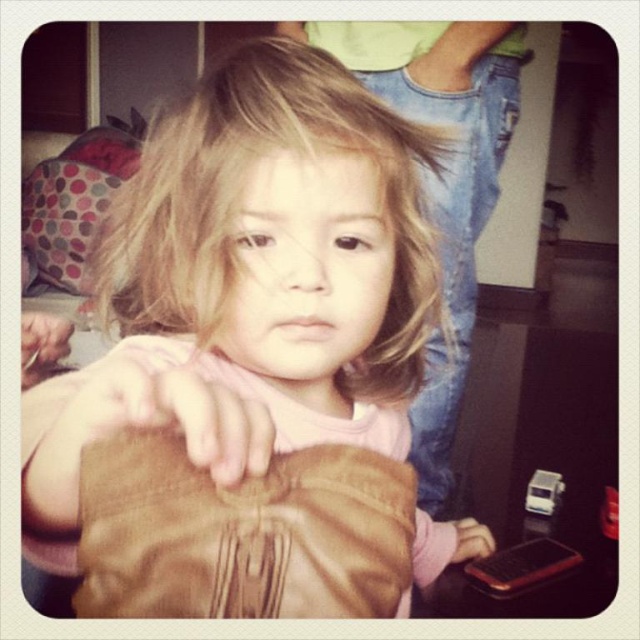
Question: Among these points, which one is farthest from the camera?

Choices:
 (A) (64, 353)
 (B) (163, 413)
 (C) (192, 588)

Answer: (A)

Question: Among these objects, which one is farthest from the camera?

Choices:
 (A) brown leather handbag at lower left
 (B) brown leather handbag at lower right
 (C) leather glove at center

Answer: (B)

Question: Does matte brown purse at center have a lesser width compared to brown leather handbag at lower right?

Choices:
 (A) yes
 (B) no

Answer: (B)

Question: Which of the following is the farthest from the observer?

Choices:
 (A) (477, 550)
 (B) (225, 413)

Answer: (A)

Question: Is matte brown purse at center above matte brown jacket at center?

Choices:
 (A) yes
 (B) no

Answer: (B)

Question: Does leather bag at center appear on the right side of matte brown jacket at center?

Choices:
 (A) yes
 (B) no

Answer: (B)